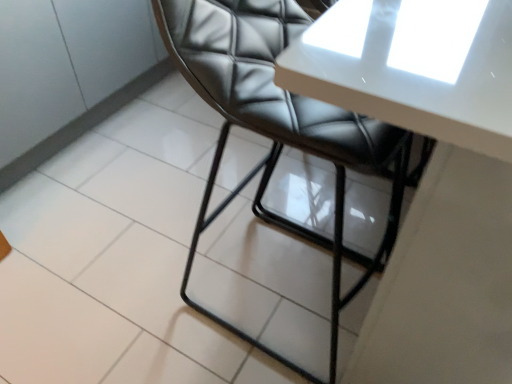
Question: Is point (245, 49) closer or farther from the camera than point (502, 170)?

Choices:
 (A) farther
 (B) closer

Answer: (A)

Question: Considering the positions of black leather chair at center and white glossy table at upper center in the image, is black leather chair at center wider or thinner than white glossy table at upper center?

Choices:
 (A) thin
 (B) wide

Answer: (A)

Question: From the image's perspective, relative to white glossy table at upper center, is black leather chair at center above or below?

Choices:
 (A) above
 (B) below

Answer: (B)

Question: Based on their positions, is white glossy table at upper center located to the left or right of black leather chair at center?

Choices:
 (A) left
 (B) right

Answer: (B)

Question: Is white glossy table at upper center bigger or smaller than black leather chair at center?

Choices:
 (A) big
 (B) small

Answer: (A)

Question: Relative to black leather chair at center, is white glossy table at upper center in front or behind?

Choices:
 (A) front
 (B) behind

Answer: (A)

Question: From the image's perspective, relative to black leather chair at center, is white glossy table at upper center above or below?

Choices:
 (A) above
 (B) below

Answer: (A)